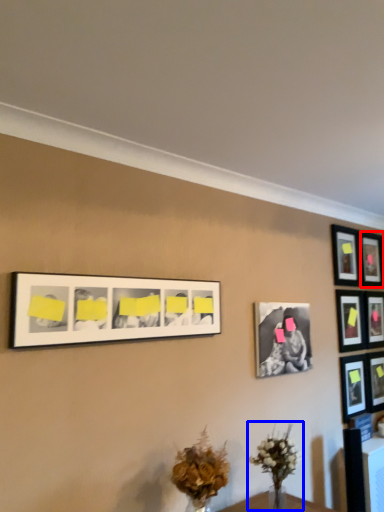
Question: Which object is closer to the camera taking this photo, picture frame (highlighted by a red box) or floral arrangement (highlighted by a blue box)?

Choices:
 (A) picture frame
 (B) floral arrangement

Answer: (B)